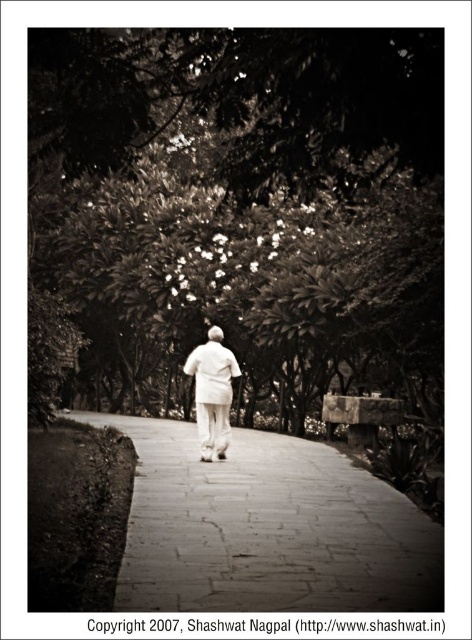
You are standing at the starting point of the paved stone path at center and want to reach the green leafy tree at center. Which direction should you walk to get closer to the tree?

The green leafy tree at center is in front of the paved stone path at center, so you should walk forward along the path to approach the tree.

You are standing at the starting point of the paved stone path at center and want to reach the white matte coat at center. Which direction should you move to get closer to the coat?

The paved stone path at center is in front of the white matte coat at center, so you should move backward along the path to get closer to the coat.

You are standing at the start of the pathway and see the green leafy tree at center and the white matte coat at center. Which object is higher in the scene?

The green leafy tree at center is located above the white matte coat at center, so it is higher in the scene.